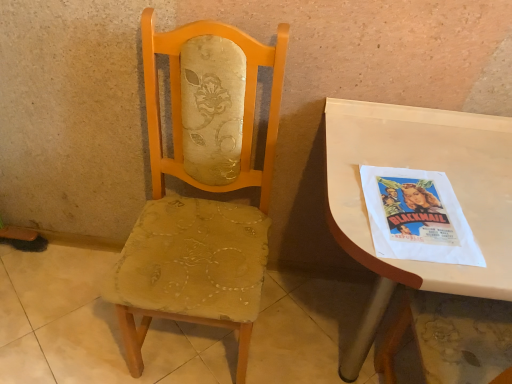
This screenshot has height=384, width=512. In order to click on vacant area located to the right-hand side of white paper poster at right in this screenshot , I will do `click(485, 203)`.